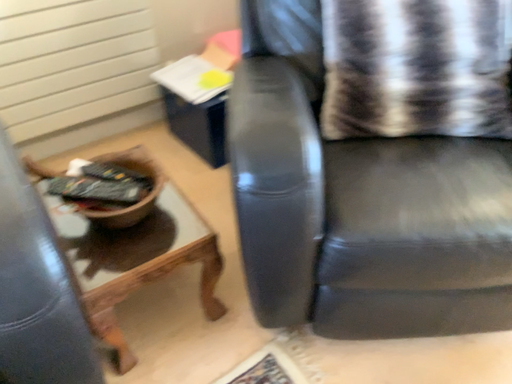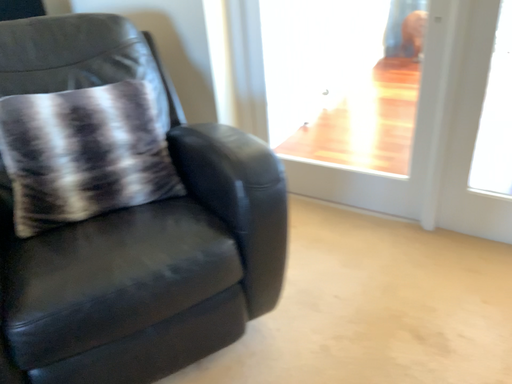
Question: Which way did the camera rotate in the video?

Choices:
 (A) rotated downward
 (B) rotated upward

Answer: (B)